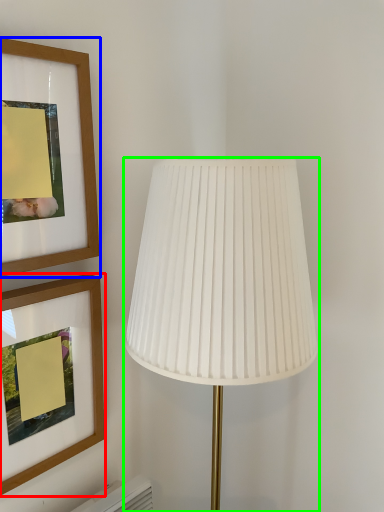
Question: Considering the real-world distances, which object is closest to picture frame (highlighted by a red box)? picture frame (highlighted by a blue box) or lamp (highlighted by a green box).

Choices:
 (A) picture frame
 (B) lamp

Answer: (A)